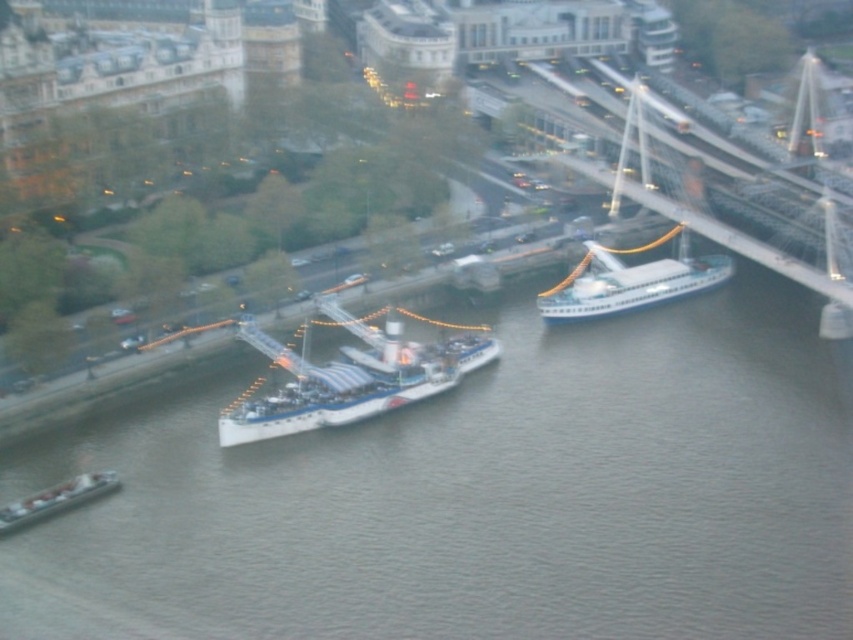
You are a delivery drone that needs to fly over the gray water at center and the white glossy ship at center. Which one has a larger width from your perspective?

The gray water at center is wider than the white glossy ship at center according to the description.

You are standing at the point marked by the coordinates point [477,493]. Looking around, you see gray water at center. Which direction should you move to reach the nearest ship?

The point marked by the coordinates point [477,493] is located at the gray water at center. To reach the nearest ship, you should move towards the riverbank where the ships are docked. Since the ships are positioned side by side near the riverbank, moving towards the riverbank direction would lead you to the nearest ship.

You are a delivery drone that needs to fly from the white glossy ship at center to the metallic gray barge at lower left. What is the shortest distance you must travel?

The shortest distance between the white glossy ship at center and the metallic gray barge at lower left is 19.46 meters.